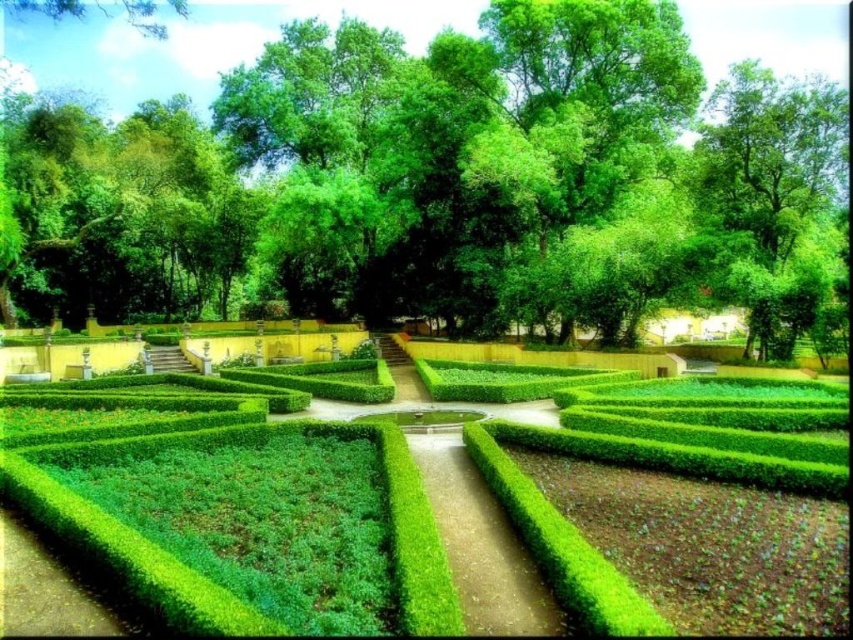
How much distance is there between green leafy tree at upper center and green hedge at center?

A distance of 32.52 meters exists between green leafy tree at upper center and green hedge at center.

Is green leafy tree at upper center positioned before green hedge at center?

No.

Between point (225, 198) and point (525, 604), which one is positioned behind?

Point (225, 198)

At what (x,y) coordinates should I click in order to perform the action: click on green leafy tree at upper center. Please return your answer as a coordinate pair (x, y). The height and width of the screenshot is (640, 853). Looking at the image, I should click on (457, 182).

Does green hedge maze at center have a greater height compared to green hedge at center?

Yes.

Describe the element at coordinates (625, 464) in the screenshot. I see `green hedge maze at center` at that location.

What do you see at coordinates (625, 464) in the screenshot?
I see `green hedge maze at center` at bounding box center [625, 464].

Locate an element on the screen. Image resolution: width=853 pixels, height=640 pixels. green hedge maze at center is located at coordinates (625, 464).

Consider the image. Does green leafy tree at upper center have a smaller size compared to green hedge maze at center?

Incorrect, green leafy tree at upper center is not smaller in size than green hedge maze at center.

Which of these two, green leafy tree at upper center or green hedge maze at center, stands shorter?

green hedge maze at center

Which is behind, point (312, 285) or point (218, 442)?

Positioned behind is point (312, 285).

Find the location of a particular element. This screenshot has width=853, height=640. green leafy tree at upper center is located at coordinates (457, 182).